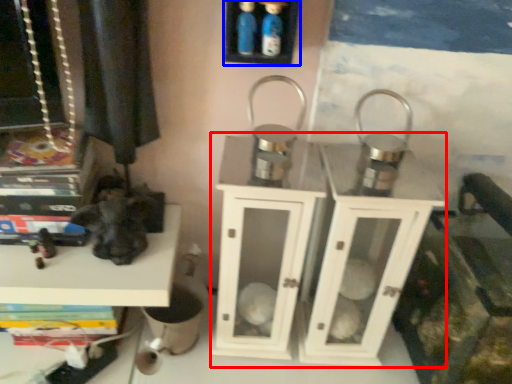
Question: Which object is further to the camera taking this photo, dresser (highlighted by a red box) or shelf (highlighted by a blue box)?

Choices:
 (A) dresser
 (B) shelf

Answer: (A)